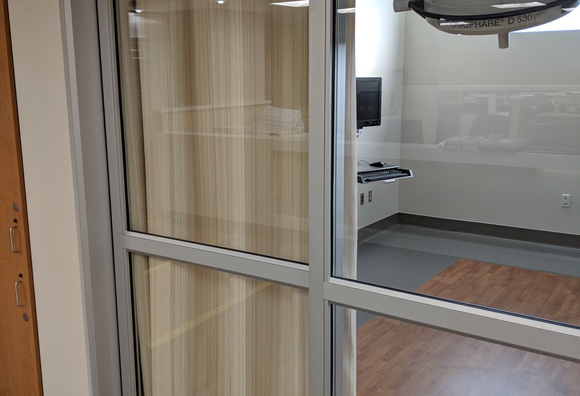
Locate an element on the screen. Image resolution: width=580 pixels, height=396 pixels. window pane is located at coordinates (234, 128), (474, 167), (448, 379), (210, 340).